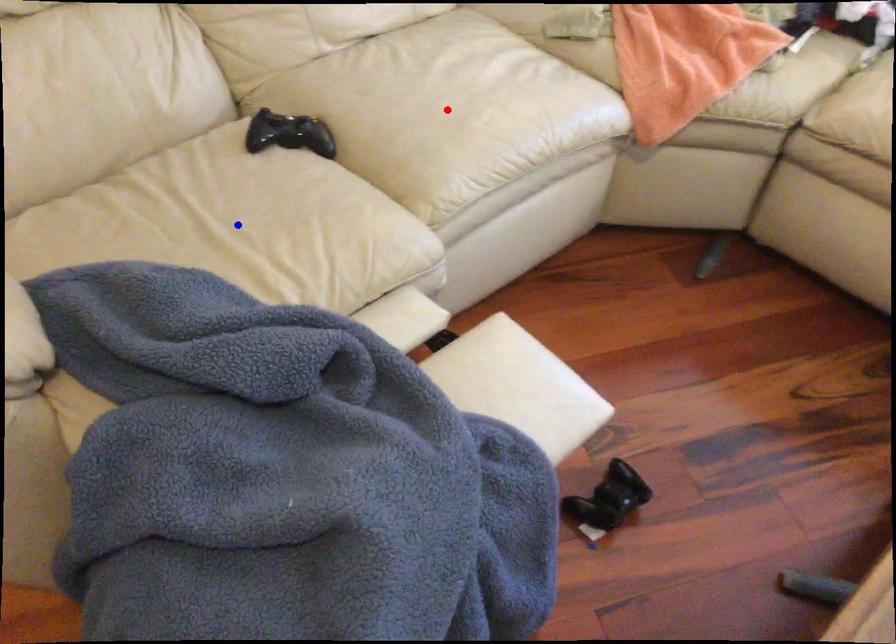
Question: Which of the two points in the image is closer to the camera?

Choices:
 (A) Blue point is closer.
 (B) Red point is closer.

Answer: (A)